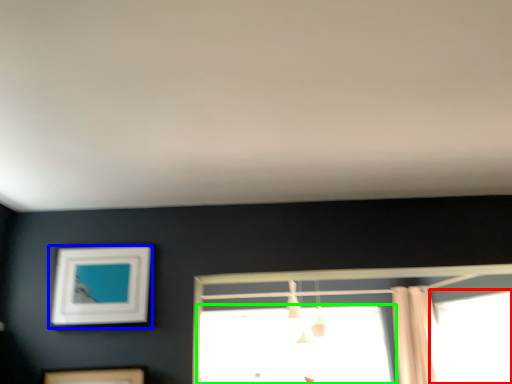
Question: Which object is the farthest from window (highlighted by a red box)? Choose among these: picture frame (highlighted by a blue box) or window (highlighted by a green box).

Choices:
 (A) picture frame
 (B) window

Answer: (A)